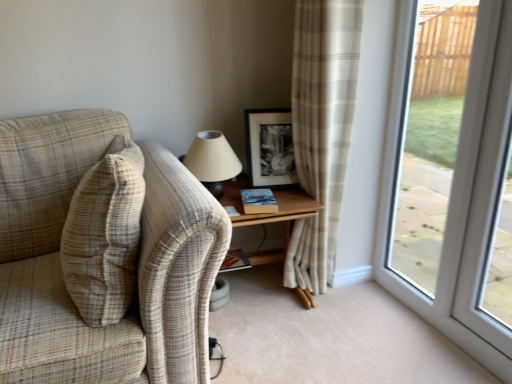
Question: From the image's perspective, is wooden table at center positioned above or below hardcover book at center, the first book from the bottom?

Choices:
 (A) above
 (B) below

Answer: (A)

Question: Do you think wooden table at center is within hardcover book at center, the 1th book from the back, or outside of it?

Choices:
 (A) outside
 (B) inside

Answer: (A)

Question: Estimate the real-world distances between objects in this image. Which object is farther from the hardcover book at center, the second book when ordered from right to left?

Choices:
 (A) beige plaid curtain at center
 (B) hardcover book at center, the 2th book ordered from the bottom
 (C) transparent glass window at right
 (D) plaid fabric couch at left
 (E) transparent glass screen door at right

Answer: (E)

Question: Considering the real-world distances, which object is closest to the wooden table at center?

Choices:
 (A) matte beige lampshade at upper center
 (B) hardcover book at center, the first book from the bottom
 (C) beige plaid pillow at left
 (D) plaid fabric couch at left
 (E) transparent glass screen door at right

Answer: (A)